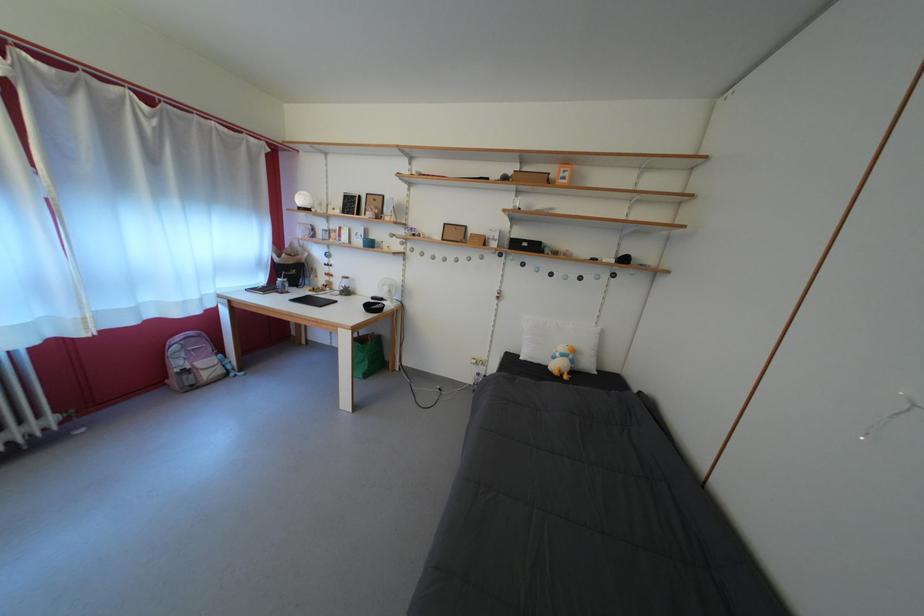
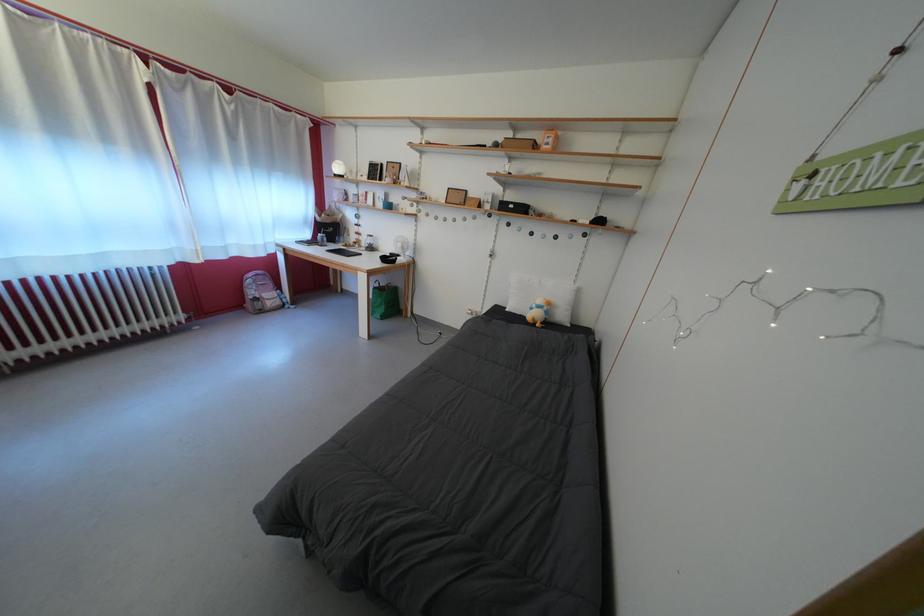
Locate, in the second image, the point that corresponds to point 580,368 in the first image.

(554, 318)